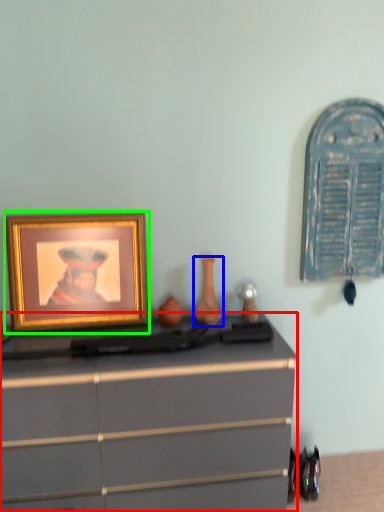
Question: Which is farther away from chest of drawers (highlighted by a red box)? vase (highlighted by a blue box) or picture frame (highlighted by a green box)?

Choices:
 (A) vase
 (B) picture frame

Answer: (A)